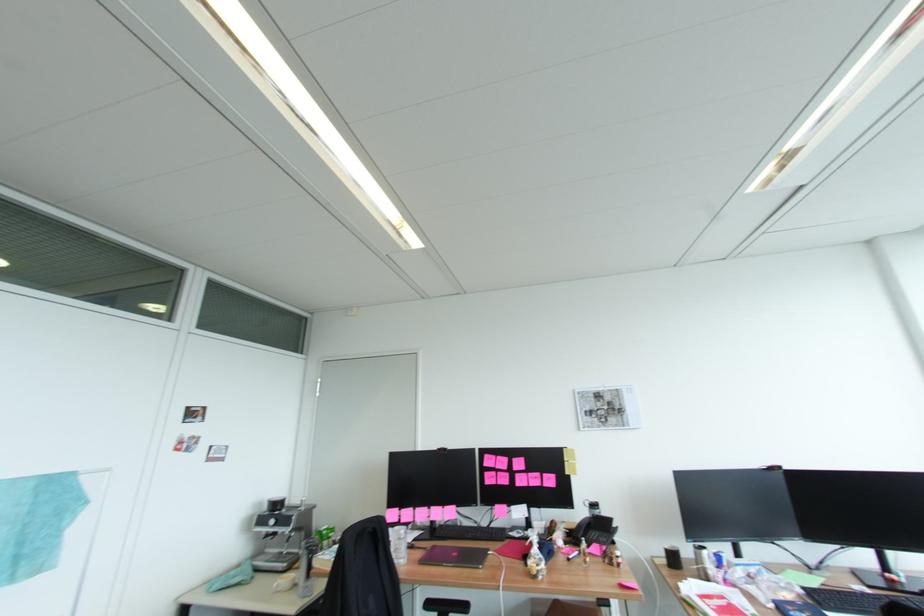
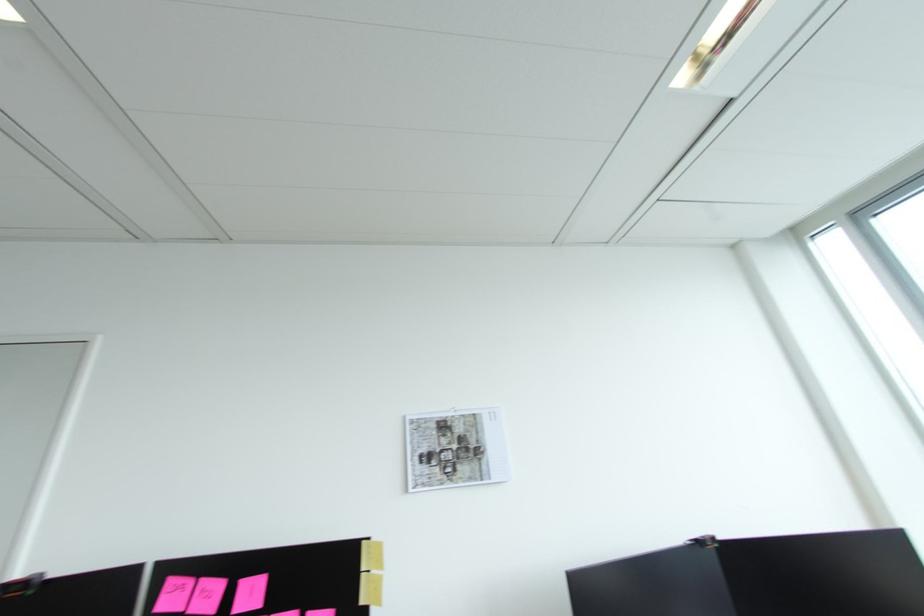
Locate, in the second image, the point that corresponds to the point at 529,468 in the first image.

(262, 605)